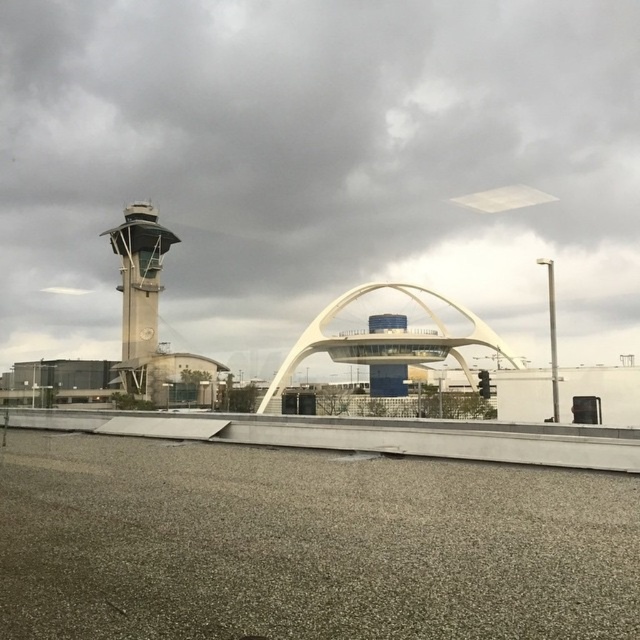
Question: Which of the following is the closest to the observer?

Choices:
 (A) white smooth arch at center
 (B) gray asphalt tarmac at lower center
 (C) concrete control tower at left
 (D) white matte arch at center

Answer: (B)

Question: Observing the image, what is the correct spatial positioning of white matte arch at center in reference to gray asphalt tarmac at lower center?

Choices:
 (A) above
 (B) below

Answer: (A)

Question: From the image, what is the correct spatial relationship of gray asphalt tarmac at lower center in relation to concrete control tower at left?

Choices:
 (A) above
 (B) below

Answer: (B)

Question: Observing the image, what is the correct spatial positioning of gray asphalt tarmac at lower center in reference to white smooth arch at center?

Choices:
 (A) above
 (B) below

Answer: (A)

Question: Among these points, which one is nearest to the camera?

Choices:
 (A) (442, 547)
 (B) (330, 113)
 (C) (172, 236)
 (D) (400, 355)

Answer: (A)

Question: Which point appears farthest from the camera in this image?

Choices:
 (A) (308, 476)
 (B) (460, 340)
 (C) (228, 204)
 (D) (132, 276)

Answer: (C)